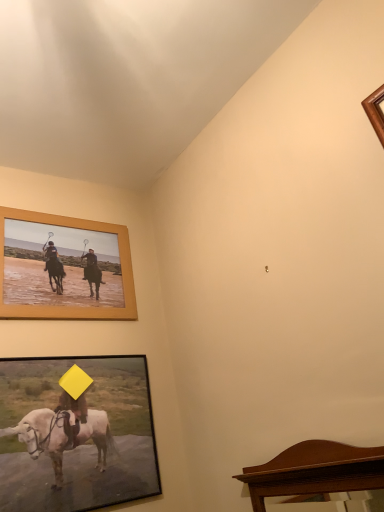
Question: Considering the relative sizes of wooden-framed picture at lower left, arranged as the second picture frame when viewed from the top, and mahogany wood mirror at lower right in the image provided, is wooden-framed picture at lower left, arranged as the second picture frame when viewed from the top, shorter than mahogany wood mirror at lower right?

Choices:
 (A) yes
 (B) no

Answer: (B)

Question: Is wooden-framed picture at lower left, the first picture frame in the bottom-to-top sequence, taller than mahogany wood mirror at lower right?

Choices:
 (A) yes
 (B) no

Answer: (A)

Question: From a real-world perspective, is wooden-framed picture at lower left, the first picture frame in the bottom-to-top sequence, physically above mahogany wood mirror at lower right?

Choices:
 (A) yes
 (B) no

Answer: (A)

Question: Is wooden-framed picture at lower left, the first picture frame in the bottom-to-top sequence, not within mahogany wood mirror at lower right?

Choices:
 (A) yes
 (B) no

Answer: (A)

Question: Is wooden-framed picture at lower left, the first picture frame in the bottom-to-top sequence, behind mahogany wood mirror at lower right?

Choices:
 (A) yes
 (B) no

Answer: (A)

Question: From the image's perspective, relative to wooden-framed picture at lower left, arranged as the second picture frame when viewed from the top, is mahogany wood mirror at lower right above or below?

Choices:
 (A) below
 (B) above

Answer: (B)

Question: Is mahogany wood mirror at lower right situated inside wooden-framed picture at lower left, arranged as the second picture frame when viewed from the top, or outside?

Choices:
 (A) inside
 (B) outside

Answer: (B)

Question: Based on their positions, is mahogany wood mirror at lower right located to the left or right of wooden-framed picture at lower left, arranged as the second picture frame when viewed from the top?

Choices:
 (A) left
 (B) right

Answer: (B)

Question: From their relative heights in the image, would you say mahogany wood mirror at lower right is taller or shorter than wooden-framed picture at lower left, arranged as the second picture frame when viewed from the top?

Choices:
 (A) short
 (B) tall

Answer: (A)

Question: Visually, is mahogany wood mirror at lower right positioned to the left or to the right of wooden frame at upper left, which is the second picture frame in bottom-to-top order?

Choices:
 (A) right
 (B) left

Answer: (A)

Question: In terms of width, does mahogany wood mirror at lower right look wider or thinner when compared to wooden frame at upper left, which appears as the 1th picture frame when viewed from the top?

Choices:
 (A) thin
 (B) wide

Answer: (B)

Question: From their relative heights in the image, would you say mahogany wood mirror at lower right is taller or shorter than wooden frame at upper left, which is the second picture frame in bottom-to-top order?

Choices:
 (A) tall
 (B) short

Answer: (B)

Question: From a real-world perspective, is mahogany wood mirror at lower right positioned above or below wooden frame at upper left, which appears as the 1th picture frame when viewed from the top?

Choices:
 (A) above
 (B) below

Answer: (B)

Question: Is wooden-framed picture at lower left, arranged as the second picture frame when viewed from the top, situated inside wooden frame at upper left, which appears as the 1th picture frame when viewed from the top, or outside?

Choices:
 (A) inside
 (B) outside

Answer: (B)

Question: From a real-world perspective, is wooden-framed picture at lower left, the first picture frame in the bottom-to-top sequence, physically located above or below wooden frame at upper left, which appears as the 1th picture frame when viewed from the top?

Choices:
 (A) above
 (B) below

Answer: (B)